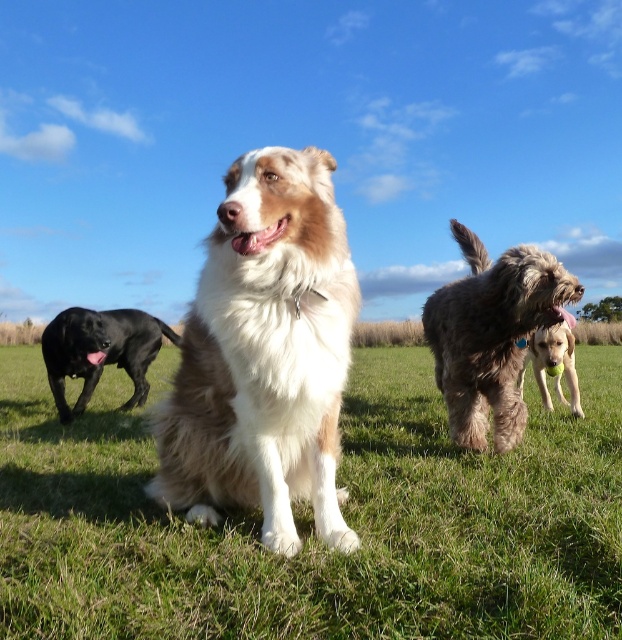
You are standing at the center of the grassy field and want to throw a ball to the shiny black dog at left. Based on the coordinates provided, in which direction should you throw the ball?

The shiny black dog at left is located at coordinates point (100, 352), so you should throw the ball to the left direction.

Based on the scene description, where is the fluffy brown dog at center right located in terms of coordinates?

The fluffy brown dog at center right is located at coordinates point [491,336].

You are a photographer trying to capture a clear shot of the fluffy brown dog at center right and the golden fur ball at center. Which dog is closer to the camera?

The fluffy brown dog at center right is closer to the camera because it is in front of the golden fur ball at center.